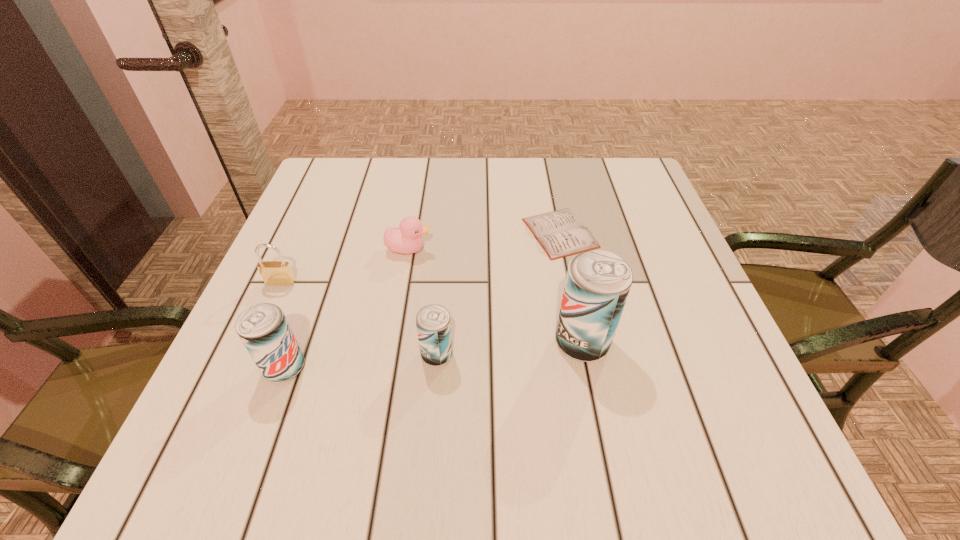
What are the coordinates of `padlock present at the left edge` in the screenshot? It's located at (279, 273).

Locate an element on the screen. The height and width of the screenshot is (540, 960). object located in the near left corner section of the desktop is located at coordinates (263, 328).

Where is `blank space at the far edge of the desktop`? The height and width of the screenshot is (540, 960). blank space at the far edge of the desktop is located at coordinates (422, 164).

Find the location of a particular element. This screenshot has height=540, width=960. vacant area at the near edge is located at coordinates (386, 405).

You are a GUI agent. You are given a task and a screenshot of the screen. Output one action in this format:
    pyautogui.click(x=<x>, y=<y>)
    Task: Click on the vacant space at the left edge of the desktop
    The image size is (960, 540).
    Given the screenshot: What is the action you would take?
    pyautogui.click(x=332, y=210)

Identify the location of free spot at the right edge of the desktop. (703, 330).

You are a GUI agent. You are given a task and a screenshot of the screen. Output one action in this format:
    pyautogui.click(x=<x>, y=<y>)
    Task: Click on the free space at the far right corner
    This screenshot has width=960, height=540.
    Given the screenshot: What is the action you would take?
    pyautogui.click(x=590, y=179)

This screenshot has height=540, width=960. I want to click on vacant area that lies between the diary and the fourth nearest object, so click(420, 258).

The width and height of the screenshot is (960, 540). What are the coordinates of `vacant region between the fourth object from right to left and the second tallest object` in the screenshot? It's located at point(347,308).

Identify the location of vacant area that lies between the diary and the third object from right to left. (498, 294).